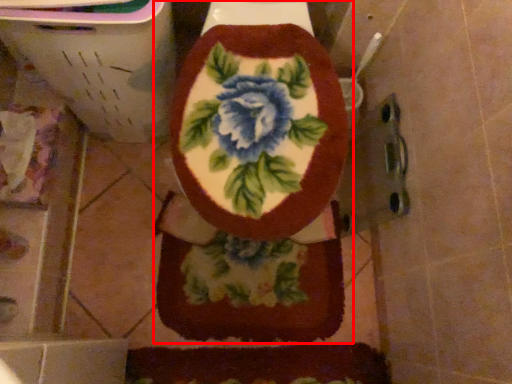
Question: From the image's perspective, what is the correct spatial positioning of toilet (annotated by the red box) in reference to blanket?

Choices:
 (A) below
 (B) above

Answer: (B)